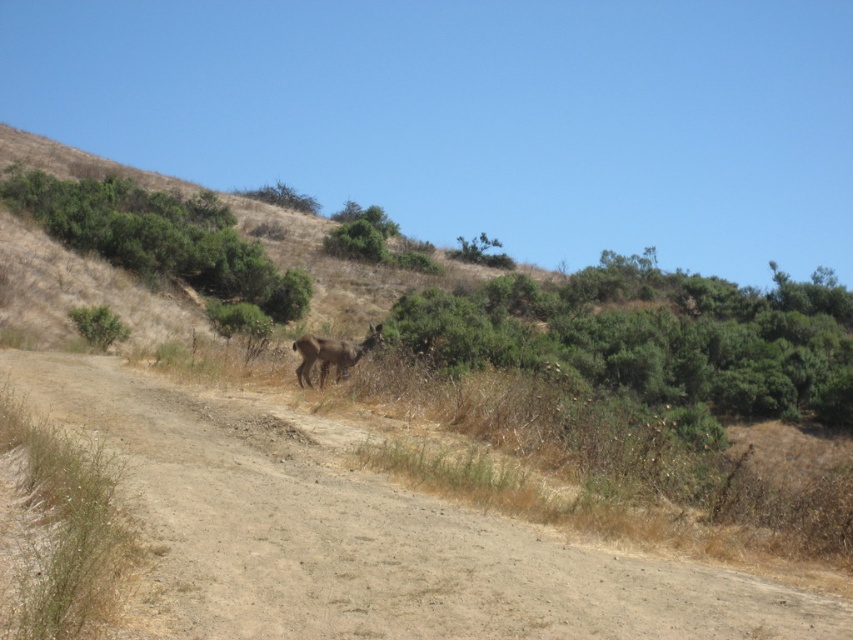
You are a hiker standing on the brown dirt track at center and want to see the brown furry deer at center. Which direction should you look to see the deer?

The brown dirt track at center is much taller than the brown furry deer at center, so you should look downward to see the deer.

You are a hiker who wants to walk along the brown dirt track at center. However, you notice a brown furry deer at center blocking your path. Can you walk around the deer without leaving the track?

The brown dirt track at center is bigger than the brown furry deer at center, so yes, you can walk around the deer while staying on the track since the track has enough space.